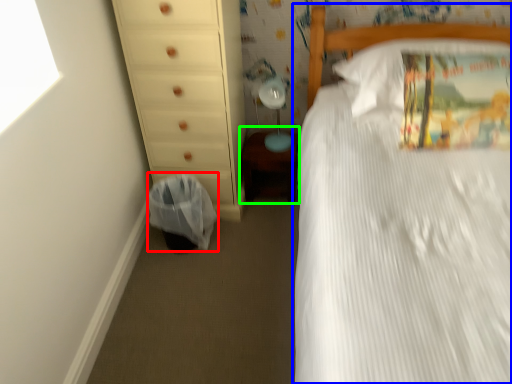
Question: Which object is positioned farthest from laundry basket (highlighted by a red box)? Select from bed (highlighted by a blue box) and changing table (highlighted by a green box).

Choices:
 (A) bed
 (B) changing table

Answer: (A)